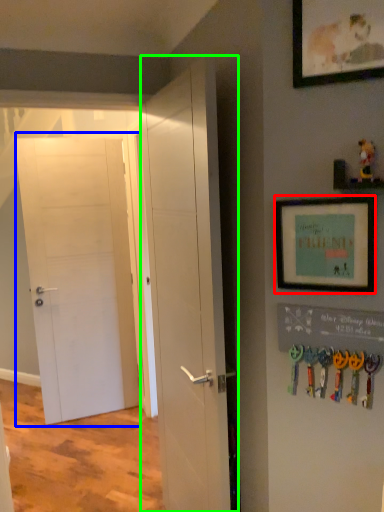
Question: Which is nearer to the picture frame (highlighted by a red box)? door (highlighted by a blue box) or door (highlighted by a green box).

Choices:
 (A) door
 (B) door

Answer: (B)